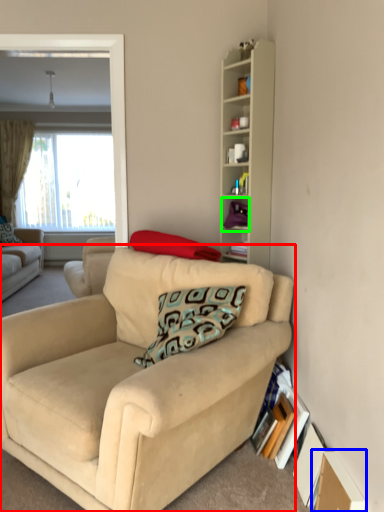
Question: Which object is positioned closest to studio couch (highlighted by a red box)? Select from cardboard box (highlighted by a blue box) and cabinet (highlighted by a green box).

Choices:
 (A) cardboard box
 (B) cabinet

Answer: (A)